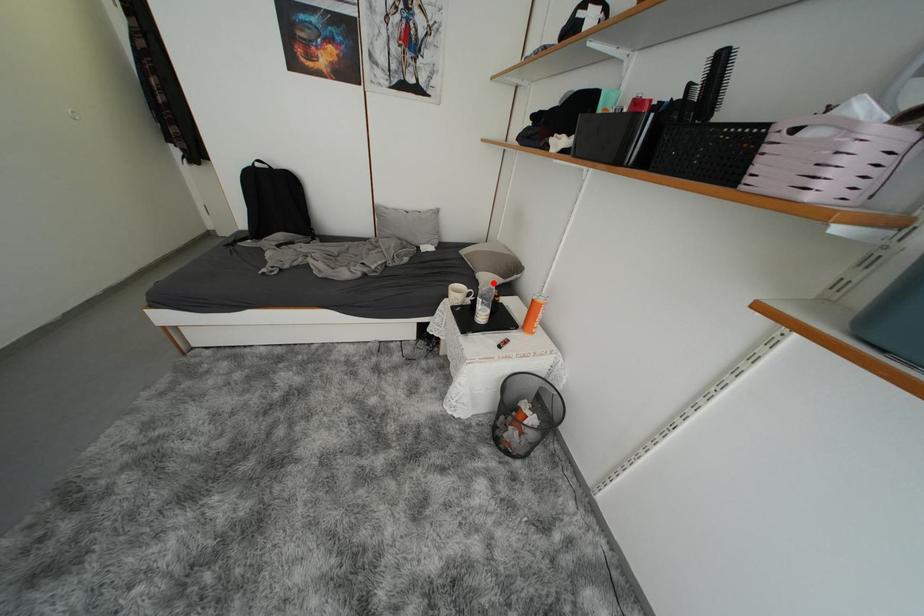
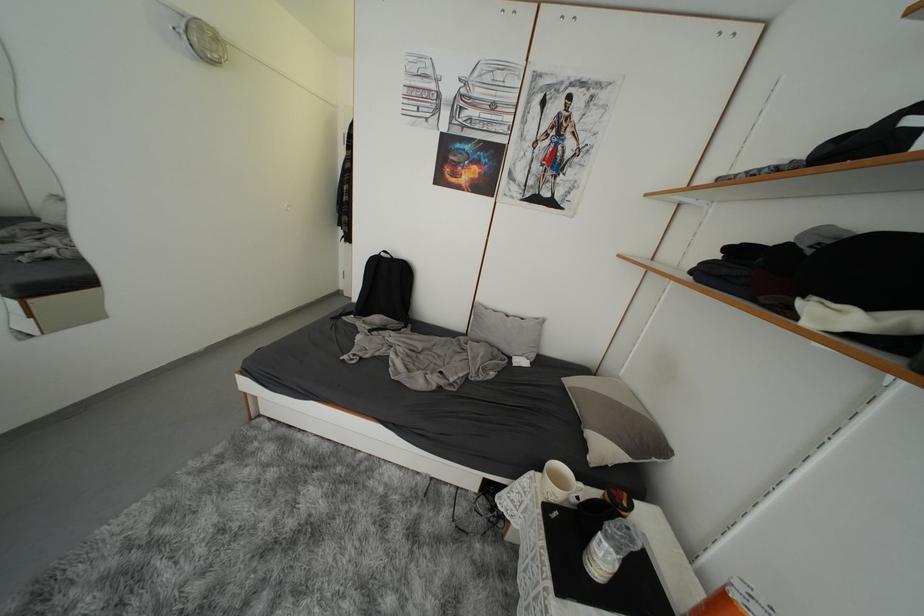
The point at the highlighted location is marked in the first image. Where is the corresponding point in the second image?

(610, 453)